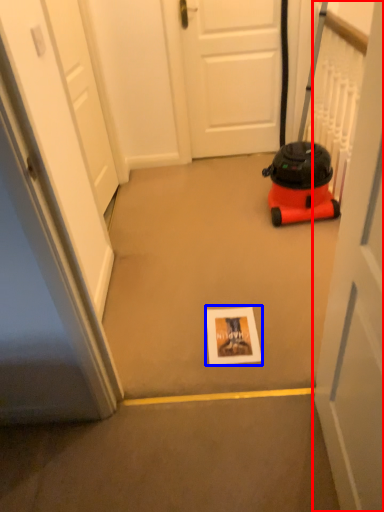
Question: Which point is further to the camera, door (highlighted by a red box) or postcard (highlighted by a blue box)?

Choices:
 (A) door
 (B) postcard

Answer: (B)